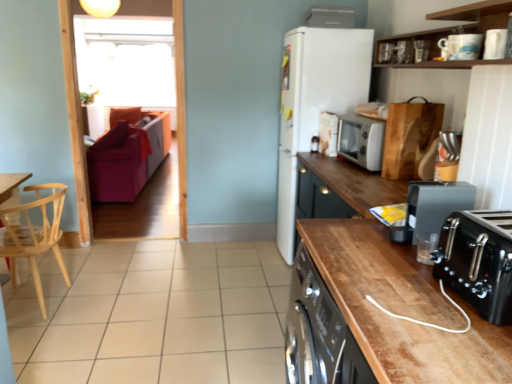
Where is `free point above beige tile at lower center (from a real-world perspective)`? The width and height of the screenshot is (512, 384). free point above beige tile at lower center (from a real-world perspective) is located at coordinates (165, 304).